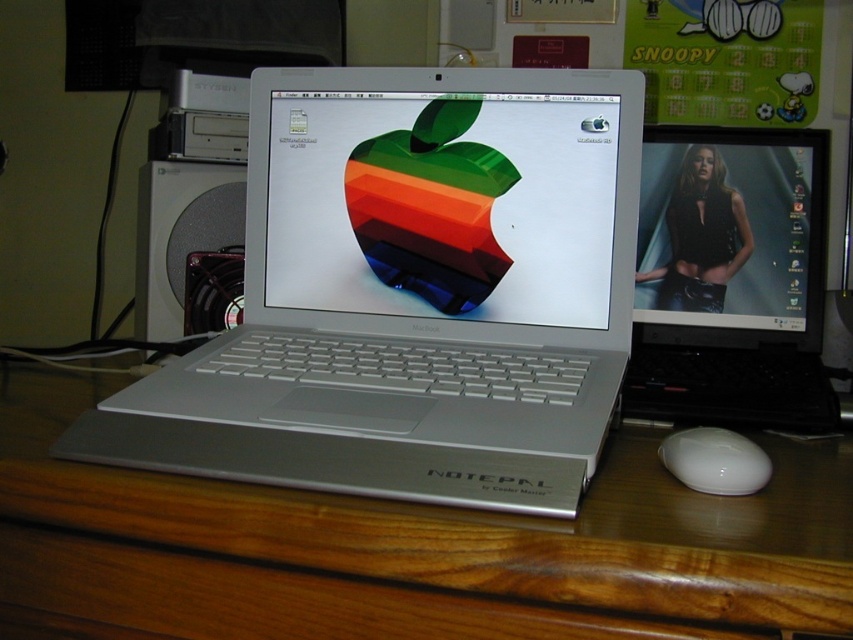
Between matte black monitor at upper right and white glossy mouse at lower right, which one appears on the left side from the viewer's perspective?

white glossy mouse at lower right

Is point (751, 288) less distant than point (714, 481)?

No, (751, 288) is further to viewer.

Is point (747, 141) farther from viewer compared to point (672, 435)?

Yes, it is behind point (672, 435).

At what (x,y) coordinates should I click in order to perform the action: click on matte black monitor at upper right. Please return your answer as a coordinate pair (x, y). The width and height of the screenshot is (853, 640). Looking at the image, I should click on (732, 236).

Is silver metallic laptop at center shorter than white glossy mouse at lower right?

No.

Is silver metallic laptop at center below white glossy mouse at lower right?

Actually, silver metallic laptop at center is above white glossy mouse at lower right.

Identify the location of silver metallic laptop at center. (412, 292).

In the scene shown: Who is more forward, (405, 545) or (637, 305)?

Positioned in front is point (405, 545).

Which is above, wooden at center or matte black monitor at upper right?

matte black monitor at upper right is above.

I want to click on wooden at center, so click(456, 538).